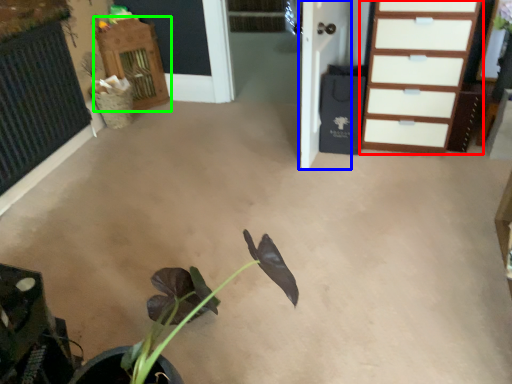
Question: Based on their relative distances, which object is farther from chest of drawers (highlighted by a red box)? Choose from door (highlighted by a blue box) and dresser (highlighted by a green box).

Choices:
 (A) door
 (B) dresser

Answer: (B)